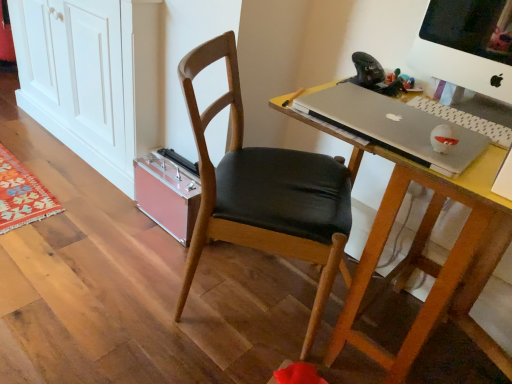
Question: Considering the positions of point (144, 49) and point (222, 102), is point (144, 49) closer or farther from the camera than point (222, 102)?

Choices:
 (A) farther
 (B) closer

Answer: (A)

Question: In terms of width, does pink plastic cabinet at lower left look wider or thinner when compared to wooden chair at center?

Choices:
 (A) thin
 (B) wide

Answer: (B)

Question: Which object is positioned closest to the white plastic computer monitor at upper right?

Choices:
 (A) silver metallic laptop at center
 (B) gray matte laptop keyboard at right
 (C) wooden desk at center
 (D) pink plastic cabinet at lower left
 (E) wooden chair at center

Answer: (B)

Question: Based on their relative distances, which object is nearer to the pink plastic cabinet at lower left?

Choices:
 (A) white plastic computer monitor at upper right
 (B) wooden desk at center
 (C) wooden chair at center
 (D) silver metallic laptop at center
 (E) gray matte laptop keyboard at right

Answer: (C)